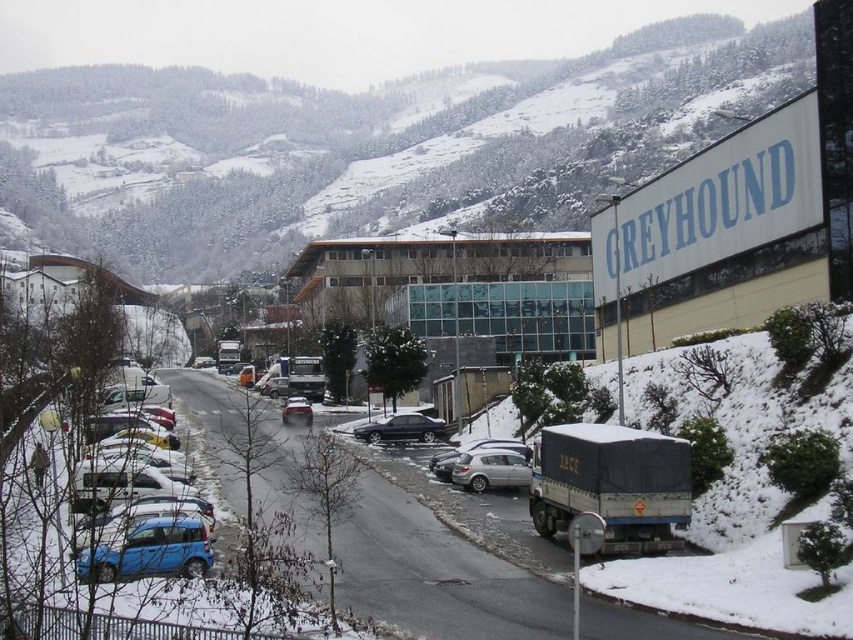
Which of these two, matte blue hatchback at lower left or satin black sedan at center, stands taller?

matte blue hatchback at lower left is taller.

What do you see at coordinates (149, 550) in the screenshot? I see `matte blue hatchback at lower left` at bounding box center [149, 550].

At what (x,y) coordinates should I click in order to perform the action: click on matte blue hatchback at lower left. Please return your answer as a coordinate pair (x, y). This screenshot has width=853, height=640. Looking at the image, I should click on (149, 550).

Which of these two, matte blue hatchback at lower left or silver metallic car at center, stands taller?

Standing taller between the two is matte blue hatchback at lower left.

Which is below, matte blue hatchback at lower left or silver metallic car at center?

silver metallic car at center is lower down.

Between point (152, 561) and point (514, 486), which one is positioned in front?

Point (152, 561) is more forward.

This screenshot has height=640, width=853. Find the location of `matte blue hatchback at lower left`. matte blue hatchback at lower left is located at coordinates (149, 550).

Locate an element on the screen. Image resolution: width=853 pixels, height=640 pixels. blue matte car at left is located at coordinates (134, 502).

Which is behind, point (180, 566) or point (498, 449)?

Point (498, 449)

Is point (120, 467) positioned behind point (508, 484)?

That is False.

The width and height of the screenshot is (853, 640). Identify the location of blue matte car at left. (134, 502).